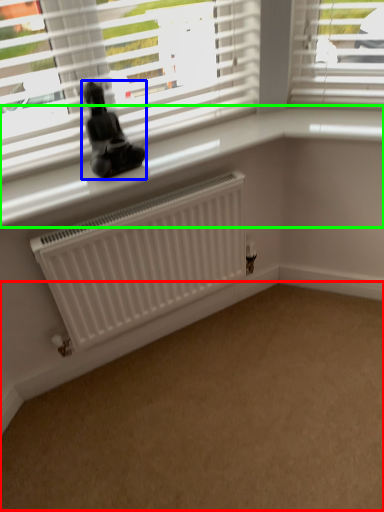
Question: Estimate the real-world distances between objects in this image. Which object is closer to plain (highlighted by a red box), miniature (highlighted by a blue box) or window sill (highlighted by a green box)?

Choices:
 (A) miniature
 (B) window sill

Answer: (B)